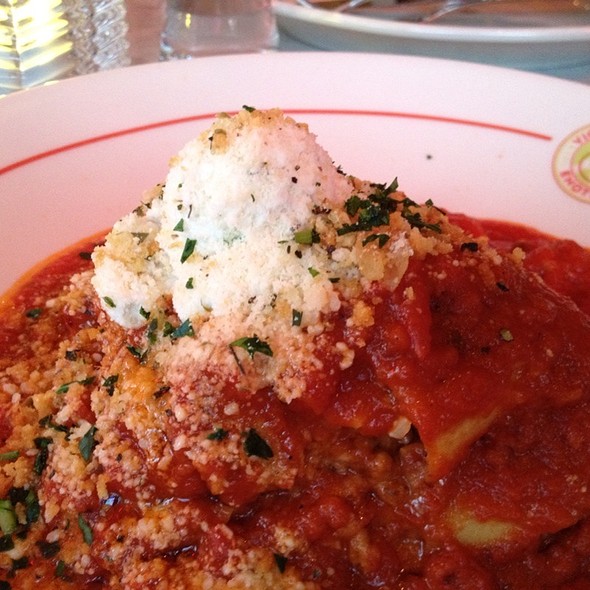
Find the location of `pink bowl`. pink bowl is located at coordinates (42, 110).